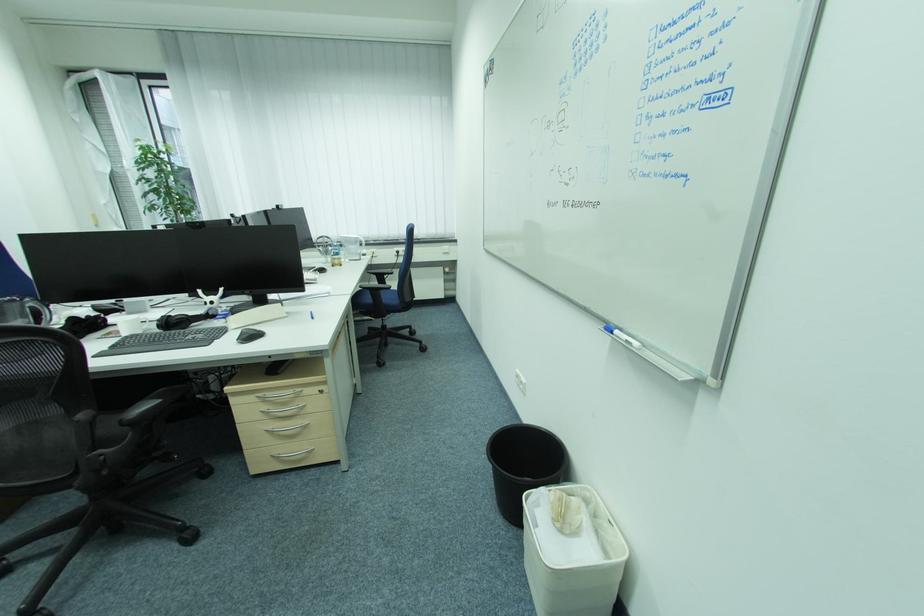
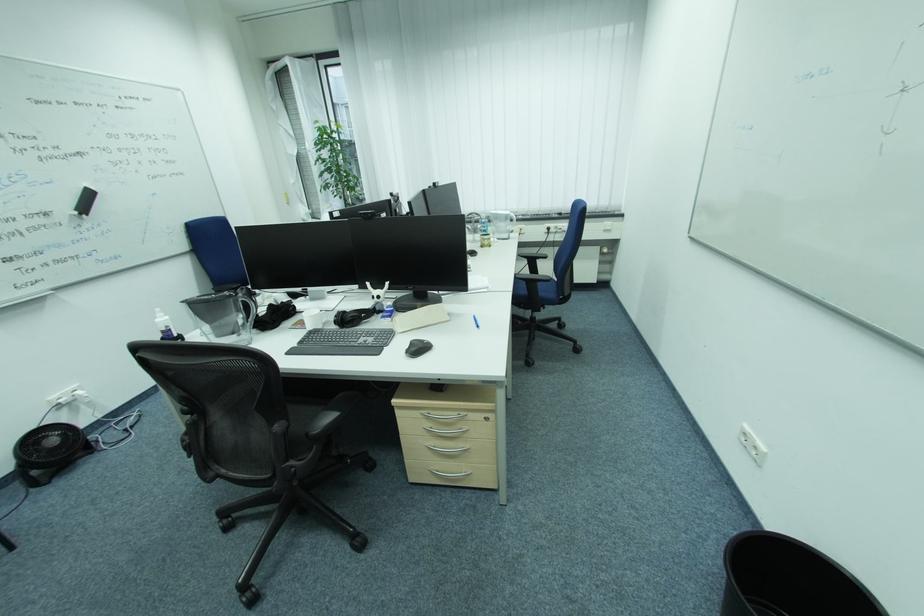
In the second image, find the point that corresponds to [381,275] in the first image.

(531, 257)